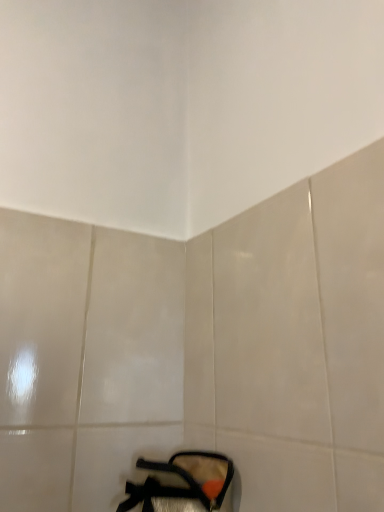
Where is `matte black shoe at lower center`? matte black shoe at lower center is located at coordinates (183, 487).

The image size is (384, 512). What do you see at coordinates (183, 487) in the screenshot?
I see `matte black shoe at lower center` at bounding box center [183, 487].

At what (x,y) coordinates should I click in order to perform the action: click on matte black shoe at lower center. Please return your answer as a coordinate pair (x, y). Looking at the image, I should click on (183, 487).